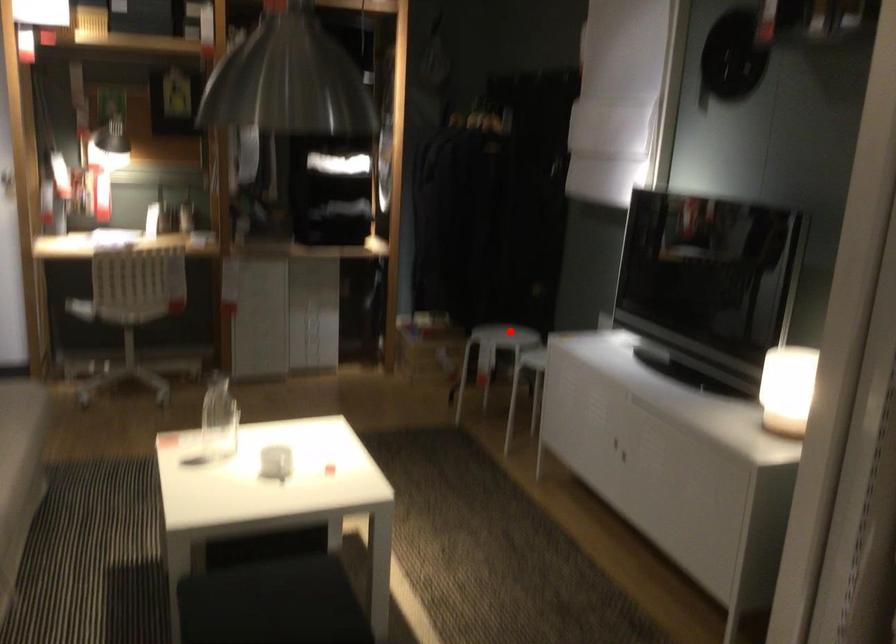
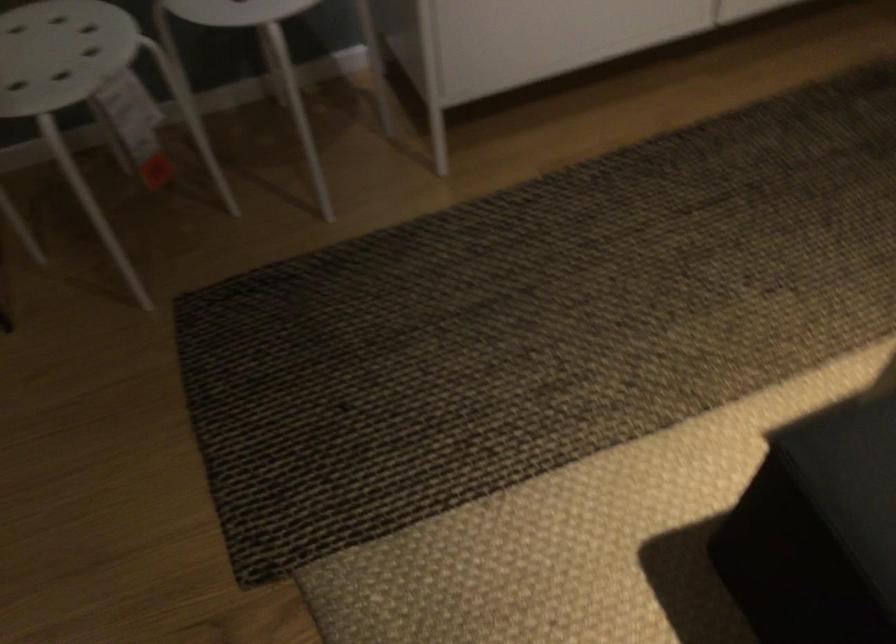
Question: I am providing you with two images of the same scene from different viewpoints. In image1, a red point is highlighted. Considering the same 3D point in image2, which of the following is correct?

Choices:
 (A) It is closer
 (B) It is farther

Answer: (A)